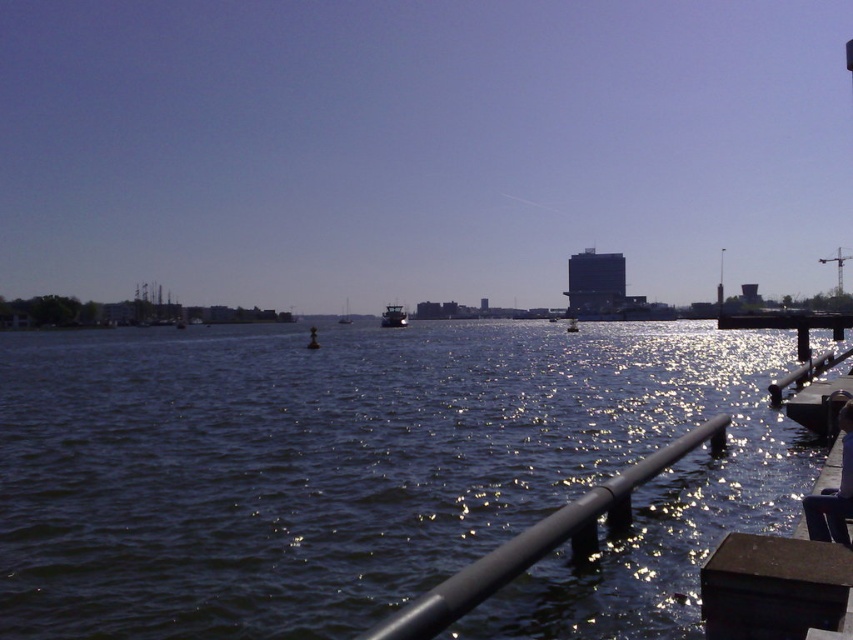
You are standing at the point with coordinates (372, 474) in the waterfront scene. What do you see directly in front of you?

You see dark blue water at center directly in front of you at point (372, 474).

You are standing on a pier and see the dark blue water at center and the metallic silver boat at center. Which object is higher from the ground?

The dark blue water at center is much taller than the metallic silver boat at center, so the dark blue water at center is higher from the ground.